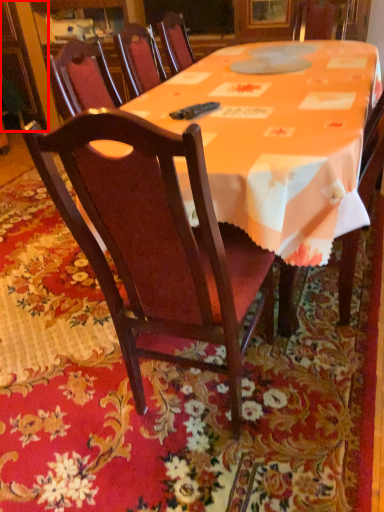
Question: From the image's perspective, where is cabinetry (annotated by the red box) located in relation to chair in the image?

Choices:
 (A) below
 (B) above

Answer: (B)